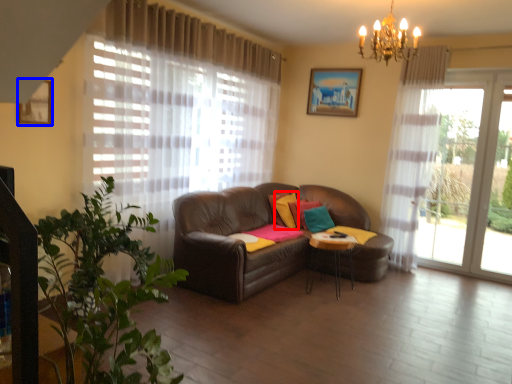
Question: Which of the following is the closest to the observer, pillow (highlighted by a red box) or picture frame (highlighted by a blue box)?

Choices:
 (A) pillow
 (B) picture frame

Answer: (B)